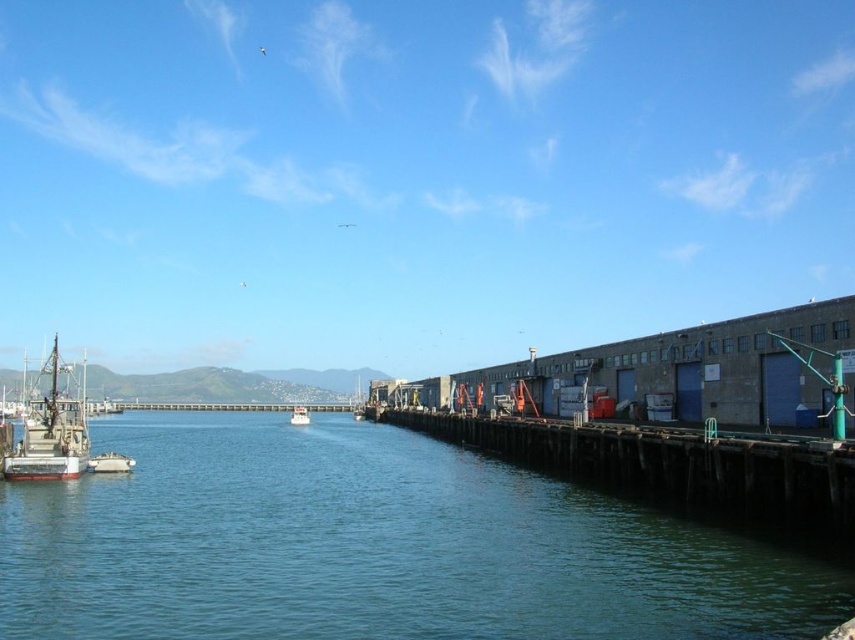
You are a dock worker who needs to secure both the white matte boat at left and the white matte boat at center. Given that the larger boat requires more mooring lines, which boat will need more mooring lines?

The white matte boat at left is larger in size than the white matte boat at center, so it will require more mooring lines.